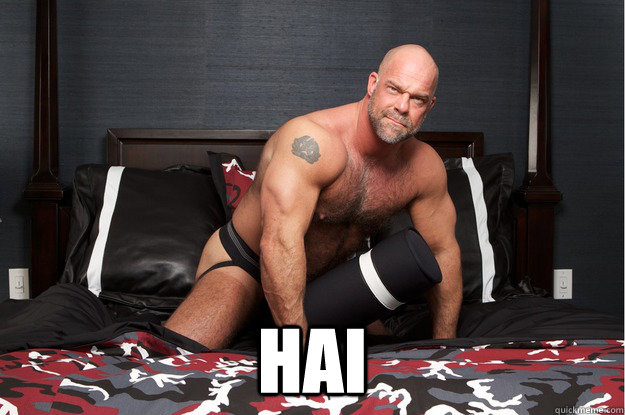
Find the location of a particular element. outlets is located at coordinates (17, 287), (565, 285).